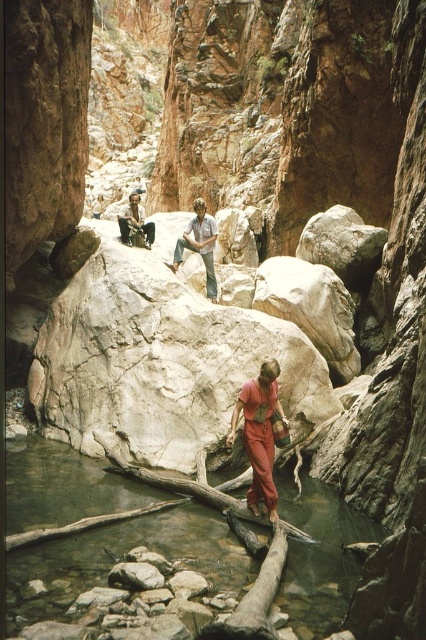
You are a hiker who wants to cross the stream safely. You notice the matte orange jumpsuit at center and the light blue denim jeans at center. Which item is closer to the water?

The matte orange jumpsuit at center is positioned under light blue denim jeans at center, meaning it is closer to the water.

You are a hiker wearing a matte orange jumpsuit at center and light blue denim jeans at center. You need to cross the stream in the canyon. The stream is 40 feet wide. Can you safely cross the stream without getting your clothes wet?

The distance between the matte orange jumpsuit at center and light blue denim jeans at center is 50.29 feet, which is wider than the 40 feet stream width. Therefore, you can safely cross the stream without getting your clothes wet by staying on the rocks between them.